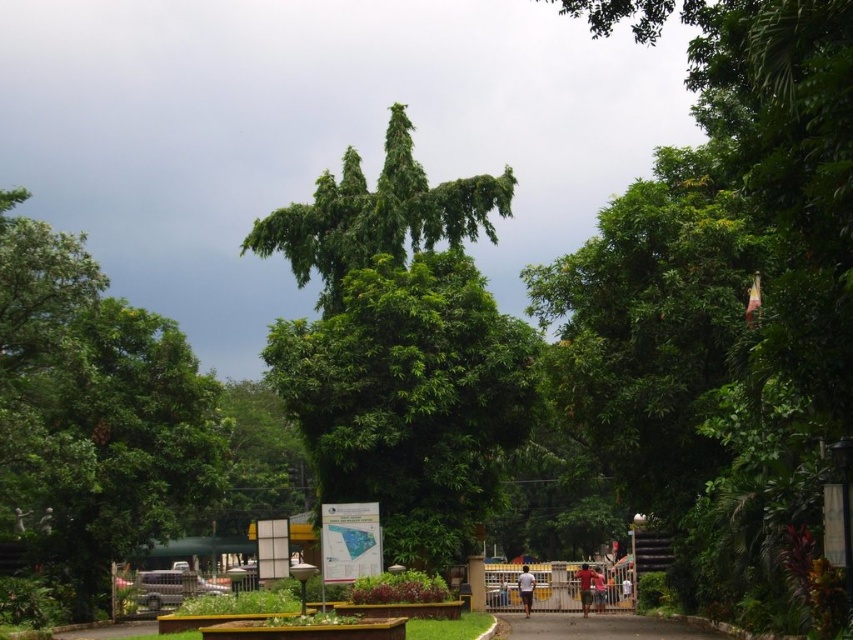
You are standing at the entrance gate and see the gray asphalt path at center and the brown fabric shirt at center. Which object is positioned to the left when facing the scene?

The gray asphalt path at center is to the left of the brown fabric shirt at center.

You are standing at the center of the scene and want to find the point at coordinates (94, 410). Which object in the scene should you look towards to locate this point?

The point at coordinates (94, 410) is located on the green leafy tree at left, so you should look towards the green leafy tree at left to find it.

Looking at this image, you are standing at the entrance of the park and want to take a photo that includes both point (691, 628) and point (595, 566). Since you want to ensure both points are in focus, which point should you focus on to maximize the depth of field?

You should focus on point (595, 566) because it is farther from the camera than point (691, 628). Focusing on the farther point will help ensure both points are within the depth of field.